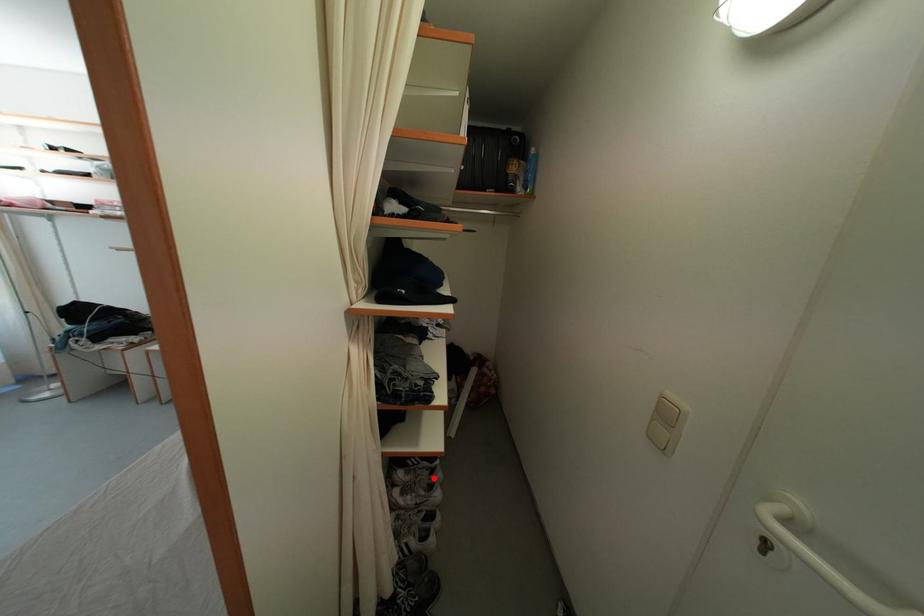
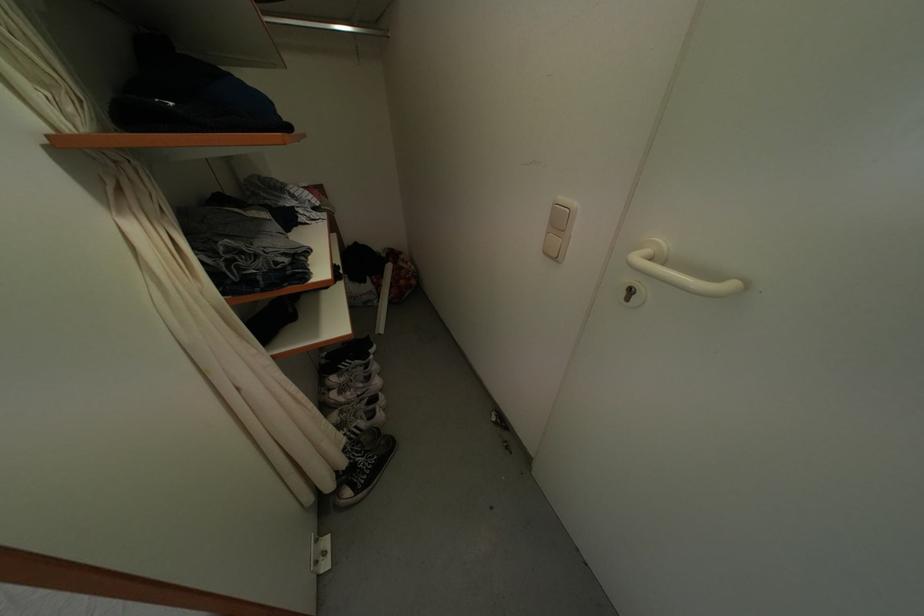
Question: A red point is marked in image1. In image2, is the corresponding 3D point closer to the camera or farther? Reply with the corresponding letter.

Choices:
 (A) The corresponding 3D point is closer.
 (B) The corresponding 3D point is farther.

Answer: (A)